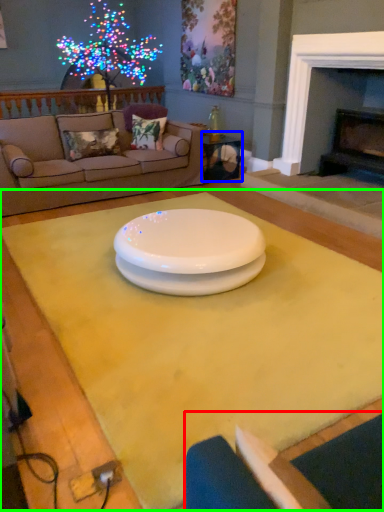
Question: Which is farther away from armchair (highlighted by a red box)? table (highlighted by a blue box) or table (highlighted by a green box)?

Choices:
 (A) table
 (B) table

Answer: (A)